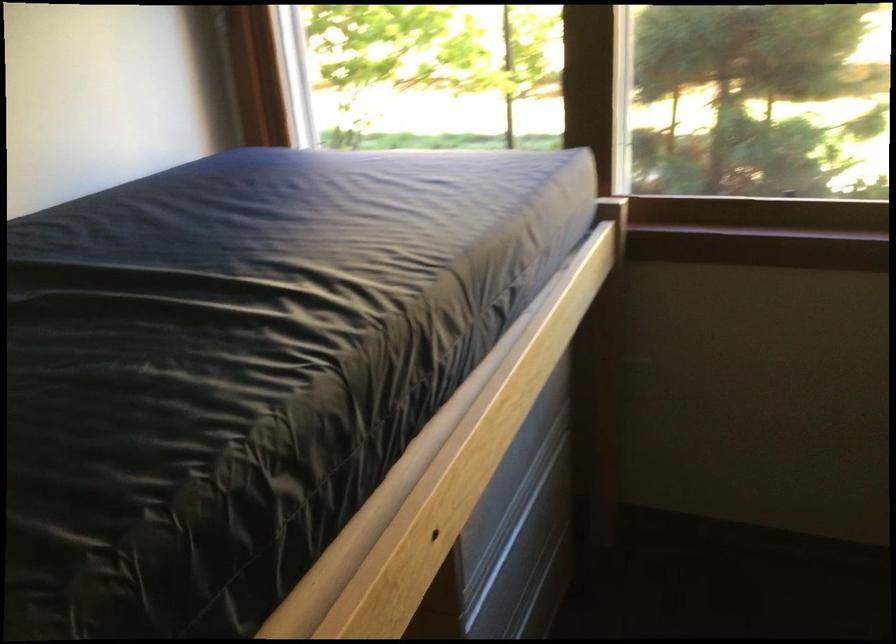
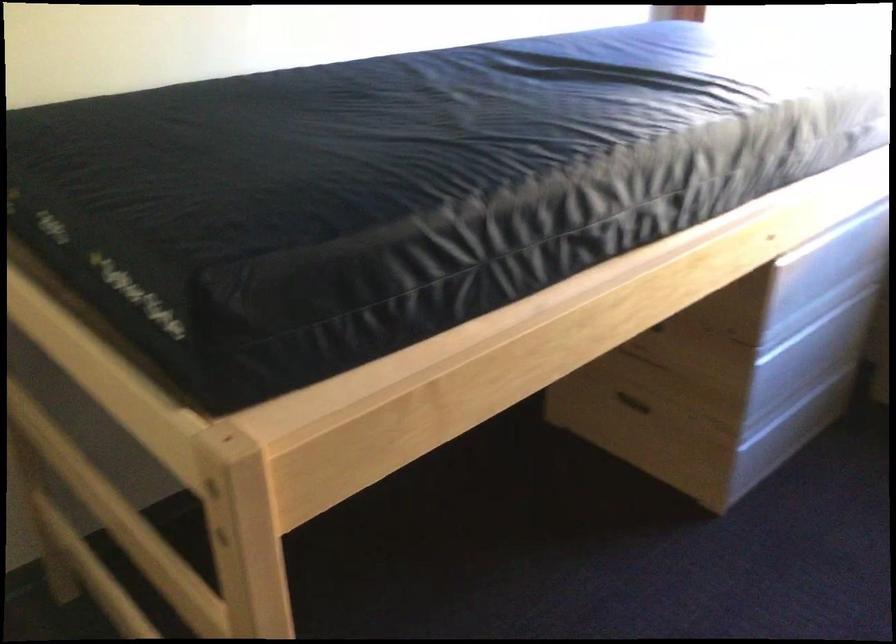
Question: In a continuous first-person perspective shot, in which direction is the camera moving?

Choices:
 (A) Left
 (B) Right
 (C) Forward
 (D) Backward

Answer: (D)